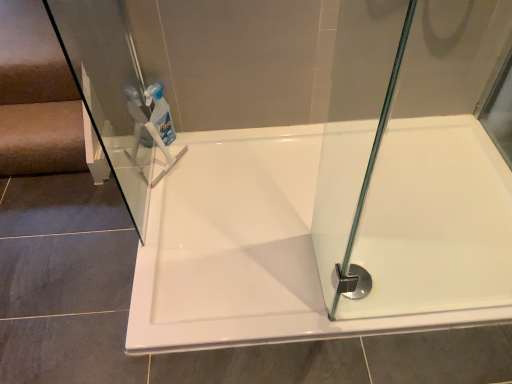
This screenshot has height=384, width=512. I want to click on free space to the back side of polished chrome shower at bottom right, so click(x=343, y=244).